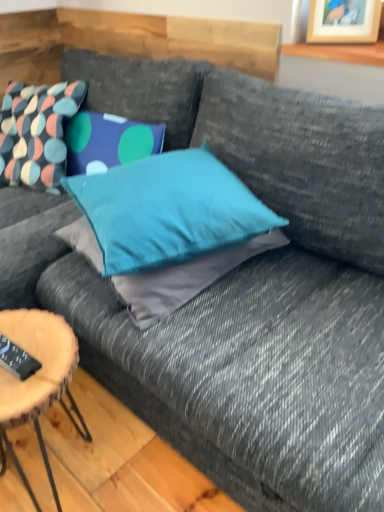
Question: From a real-world perspective, is wooden picture frame at upper right on black plastic remote control at lower left?

Choices:
 (A) yes
 (B) no

Answer: (A)

Question: Is wooden picture frame at upper right positioned with its back to black plastic remote control at lower left?

Choices:
 (A) no
 (B) yes

Answer: (A)

Question: From the image's perspective, would you say wooden picture frame at upper right is positioned over black plastic remote control at lower left?

Choices:
 (A) yes
 (B) no

Answer: (A)

Question: From the image's perspective, does wooden picture frame at upper right appear lower than black plastic remote control at lower left?

Choices:
 (A) yes
 (B) no

Answer: (B)

Question: Is wooden picture frame at upper right completely or partially outside of black plastic remote control at lower left?

Choices:
 (A) yes
 (B) no

Answer: (A)

Question: Considering the relative sizes of wooden picture frame at upper right and black plastic remote control at lower left in the image provided, is wooden picture frame at upper right thinner than black plastic remote control at lower left?

Choices:
 (A) yes
 (B) no

Answer: (B)

Question: Is wooden picture frame at upper right positioned with its back to teal fabric pillow at center, acting as the 2th pillow starting from the back?

Choices:
 (A) no
 (B) yes

Answer: (A)

Question: Considering the relative sizes of wooden picture frame at upper right and teal fabric pillow at center, arranged as the first pillow when viewed from the front, in the image provided, is wooden picture frame at upper right thinner than teal fabric pillow at center, arranged as the first pillow when viewed from the front,?

Choices:
 (A) no
 (B) yes

Answer: (B)

Question: Is wooden picture frame at upper right wider than teal fabric pillow at center, acting as the 2th pillow starting from the back?

Choices:
 (A) yes
 (B) no

Answer: (B)

Question: Is wooden picture frame at upper right smaller than teal fabric pillow at center, which ranks as the first pillow in right-to-left order?

Choices:
 (A) no
 (B) yes

Answer: (B)

Question: Is wooden picture frame at upper right to the right of teal fabric pillow at center, marked as the 2th pillow in a left-to-right arrangement, from the viewer's perspective?

Choices:
 (A) yes
 (B) no

Answer: (A)

Question: Considering the relative sizes of wooden picture frame at upper right and teal fabric pillow at center, marked as the 2th pillow in a left-to-right arrangement, in the image provided, is wooden picture frame at upper right bigger than teal fabric pillow at center, marked as the 2th pillow in a left-to-right arrangement,?

Choices:
 (A) yes
 (B) no

Answer: (B)

Question: From the image's perspective, is multicolored fabric pillow at upper left, positioned as the first pillow in back-to-front order, on top of black plastic remote control at lower left?

Choices:
 (A) yes
 (B) no

Answer: (A)